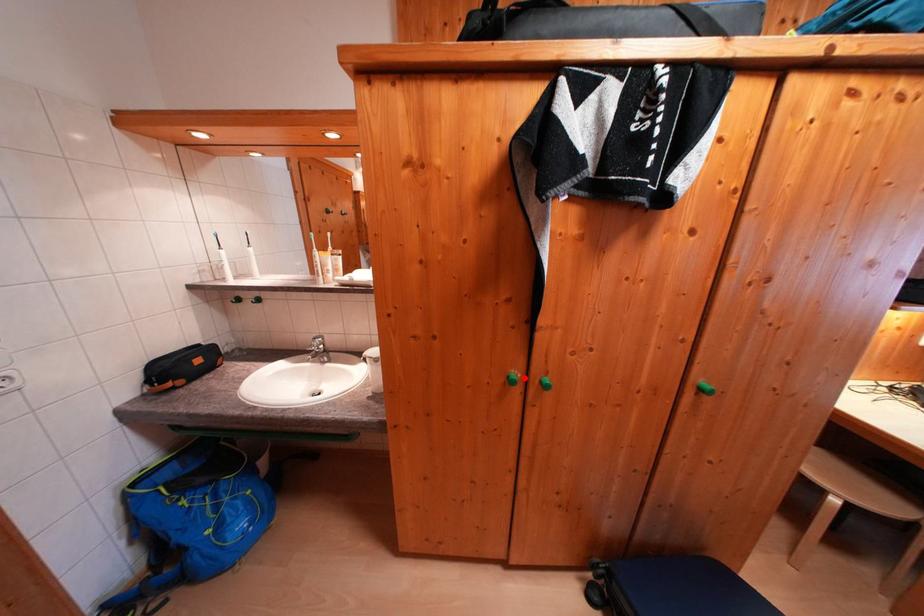
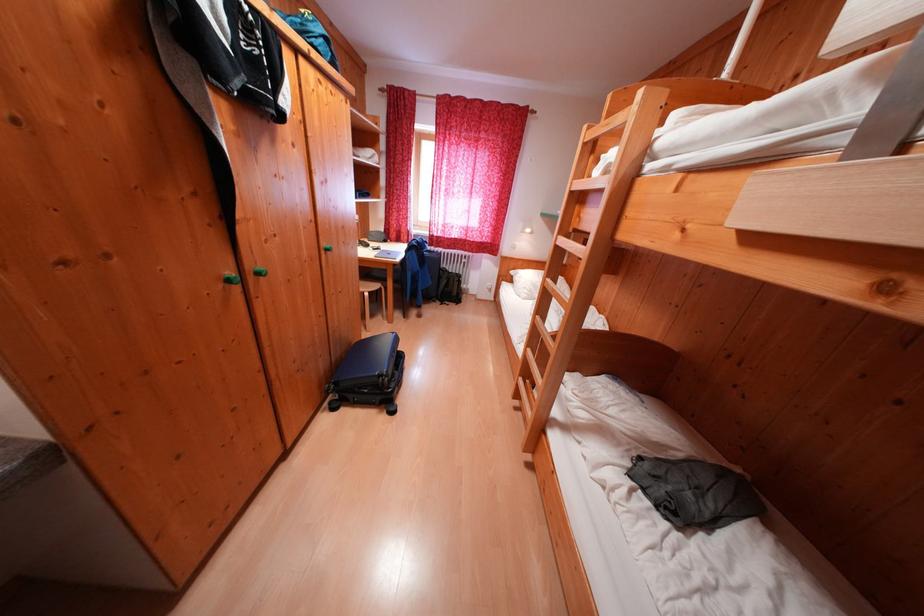
Question: I am providing you with two images of the same scene from different viewpoints. A red point is shown in image1. For the corresponding object point in image2, is it positioned nearer or farther from the camera?

Choices:
 (A) Nearer
 (B) Farther

Answer: (A)